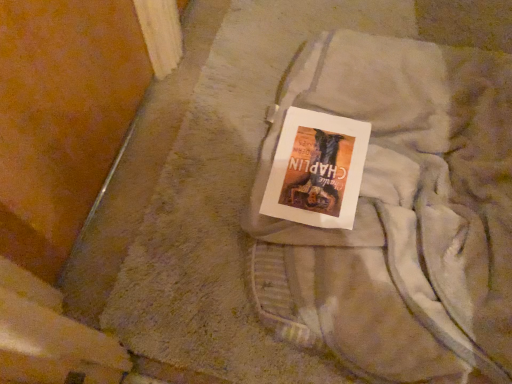
Question: From the image's perspective, relative to matte paper book at center, is light gray cotton laundry at center above or below?

Choices:
 (A) above
 (B) below

Answer: (B)

Question: Is point coord(316,296) closer or farther from the camera than point coord(364,142)?

Choices:
 (A) farther
 (B) closer

Answer: (B)

Question: Looking at their shapes, would you say light gray cotton laundry at center is wider or thinner than matte paper book at center?

Choices:
 (A) thin
 (B) wide

Answer: (B)

Question: From a real-world perspective, is matte paper book at center positioned above or below light gray cotton laundry at center?

Choices:
 (A) below
 (B) above

Answer: (B)

Question: Would you say matte paper book at center is to the left or to the right of light gray cotton laundry at center in the picture?

Choices:
 (A) right
 (B) left

Answer: (B)

Question: Is matte paper book at center situated inside light gray cotton laundry at center or outside?

Choices:
 (A) inside
 (B) outside

Answer: (A)

Question: Relative to light gray cotton laundry at center, is matte paper book at center in front or behind?

Choices:
 (A) front
 (B) behind

Answer: (B)